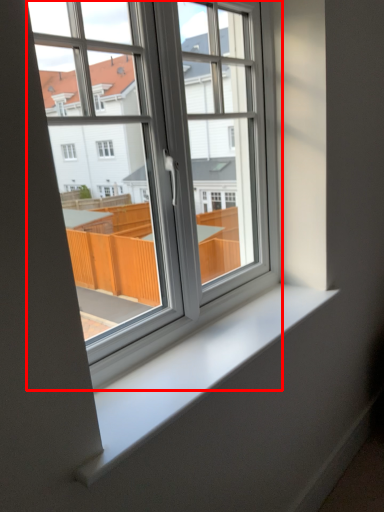
Question: From the image's perspective, where is window (annotated by the red box) located relative to window sill?

Choices:
 (A) above
 (B) below

Answer: (A)